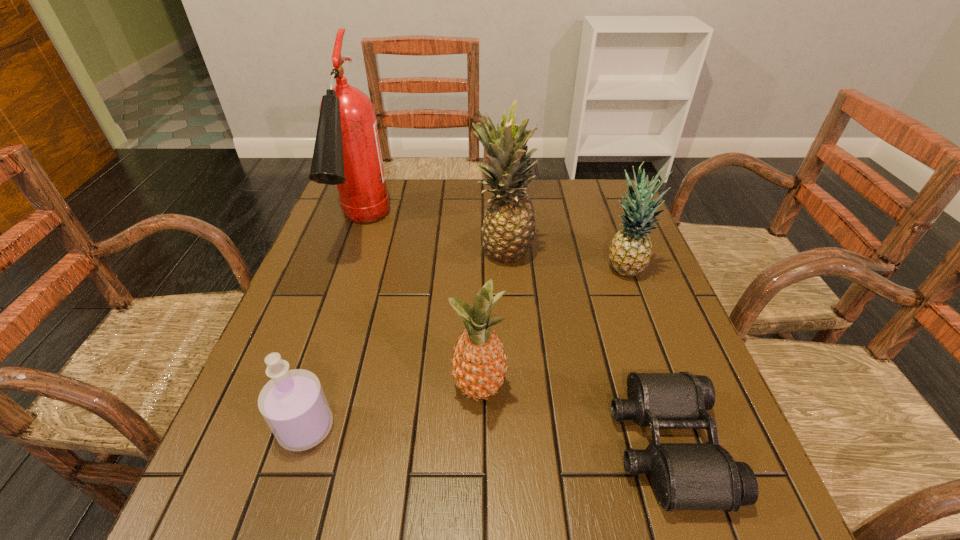
This screenshot has height=540, width=960. Identify the location of vacant space located 0.380m on the right of the second shortest object. (544, 428).

Find the location of a particular element. The height and width of the screenshot is (540, 960). vacant area situated 0.210m through the eyepieces of the binoculars is located at coordinates (496, 445).

In order to click on free space located through the eyepieces of the binoculars in this screenshot , I will do `click(410, 445)`.

You are a GUI agent. You are given a task and a screenshot of the screen. Output one action in this format:
    pyautogui.click(x=<x>, y=<y>)
    Task: Click on the free spot located through the eyepieces of the binoculars
    This screenshot has height=540, width=960.
    Given the screenshot: What is the action you would take?
    pyautogui.click(x=530, y=445)

The height and width of the screenshot is (540, 960). I want to click on object at the far edge, so click(x=347, y=153).

This screenshot has width=960, height=540. I want to click on object that is at the near edge, so click(x=685, y=476).

This screenshot has width=960, height=540. Find the location of `fire extinguisher present at the left edge`. fire extinguisher present at the left edge is located at coordinates (347, 153).

Where is `perfume located in the left edge section of the desktop`? perfume located in the left edge section of the desktop is located at coordinates (293, 403).

Where is `pineapple located in the right edge section of the desktop`? This screenshot has height=540, width=960. pineapple located in the right edge section of the desktop is located at coordinates coord(631,248).

This screenshot has width=960, height=540. In order to click on binoculars at the right edge in this screenshot , I will do `click(685, 476)`.